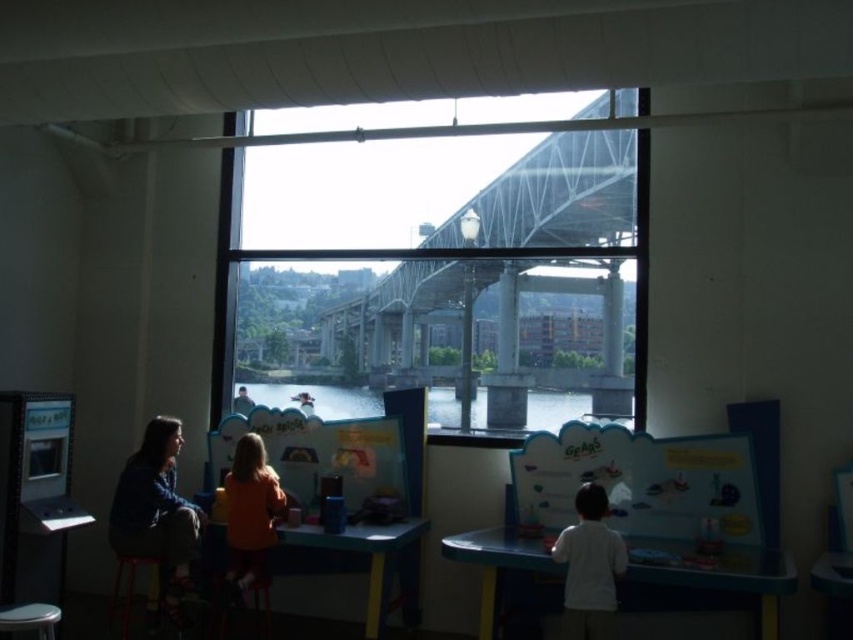
Question: Does transparent glass bridge at upper center appear under metallic stool at lower left?

Choices:
 (A) yes
 (B) no

Answer: (B)

Question: Which object is the closest to the orange fabric jacket at center?

Choices:
 (A) blue plastic table at center
 (B) metallic stool at lower left
 (C) matte red stool at lower left
 (D) matte blue jacket at left

Answer: (D)

Question: Which object appears farthest from the camera in this image?

Choices:
 (A) matte red stool at lower left
 (B) transparent glass bridge at upper center

Answer: (B)

Question: Which point is closer to the camera taking this photo?

Choices:
 (A) (148, 560)
 (B) (666, 556)
 (C) (137, 529)
 (D) (233, 356)

Answer: (B)

Question: Does blue plastic table at center appear over matte red stool at lower left?

Choices:
 (A) no
 (B) yes

Answer: (B)

Question: Is transparent glass bridge at upper center wider than matte red stool at lower left?

Choices:
 (A) yes
 (B) no

Answer: (A)